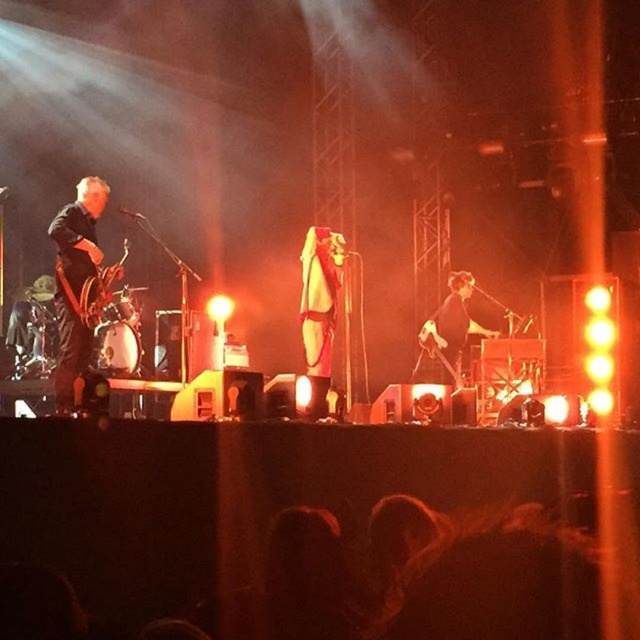
Who is more distant from viewer, (65, 246) or (333, 248)?

The point (333, 248) is behind.

Based on the photo, does dark blue leather jacket at left appear over white matte mask at center?

Actually, dark blue leather jacket at left is below white matte mask at center.

Is point (58, 292) less distant than point (328, 356)?

That is True.

The width and height of the screenshot is (640, 640). Find the location of `dark blue leather jacket at left`. dark blue leather jacket at left is located at coordinates (76, 282).

Does point (68, 259) come closer to viewer compared to point (461, 308)?

Yes, point (68, 259) is closer to viewer.

What do you see at coordinates (76, 282) in the screenshot? I see `dark blue leather jacket at left` at bounding box center [76, 282].

Between point (84, 346) and point (451, 300), which one is positioned behind?

Positioned behind is point (451, 300).

Where is `dark blue leather jacket at left`? dark blue leather jacket at left is located at coordinates (76, 282).

Does point (330, 356) lie behind point (445, 310)?

No, (330, 356) is in front of (445, 310).

Between white matte mask at center and black matte guitar at center, which one is positioned higher?

Positioned higher is white matte mask at center.

Who is more forward, [310,355] or [435,349]?

Positioned in front is point [310,355].

Locate an element on the screen. Image resolution: width=640 pixels, height=640 pixels. white matte mask at center is located at coordinates (320, 308).